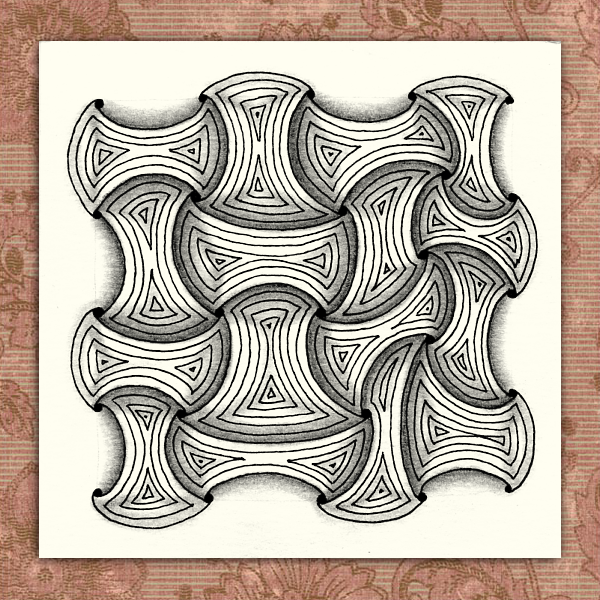
Identify the location of brown frame. (177, 22), (20, 307), (360, 575).